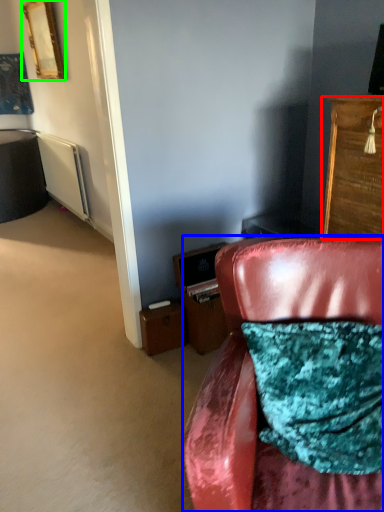
Question: Considering the real-world distances, which object is closest to cabinetry (highlighted by a red box)? chair (highlighted by a blue box) or picture frame (highlighted by a green box).

Choices:
 (A) chair
 (B) picture frame

Answer: (A)